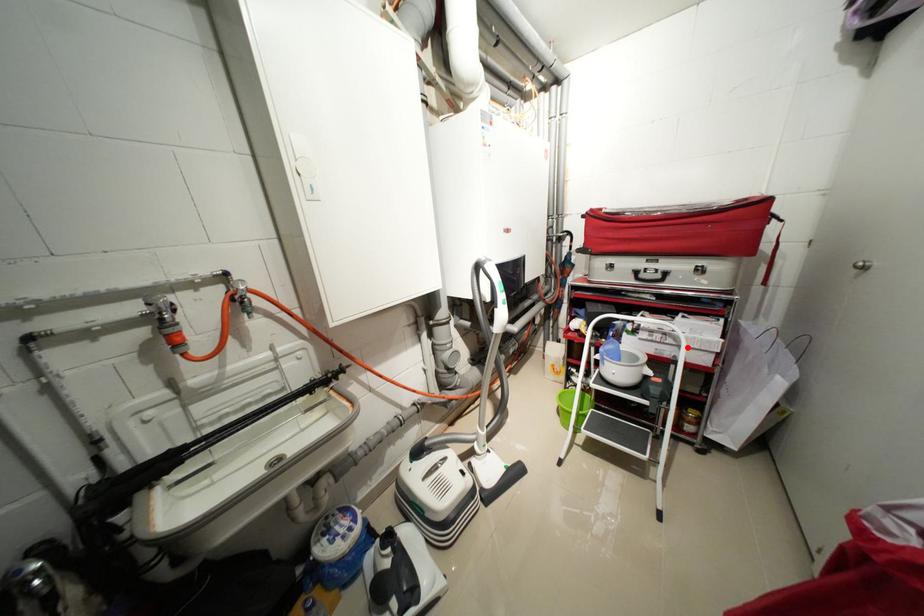
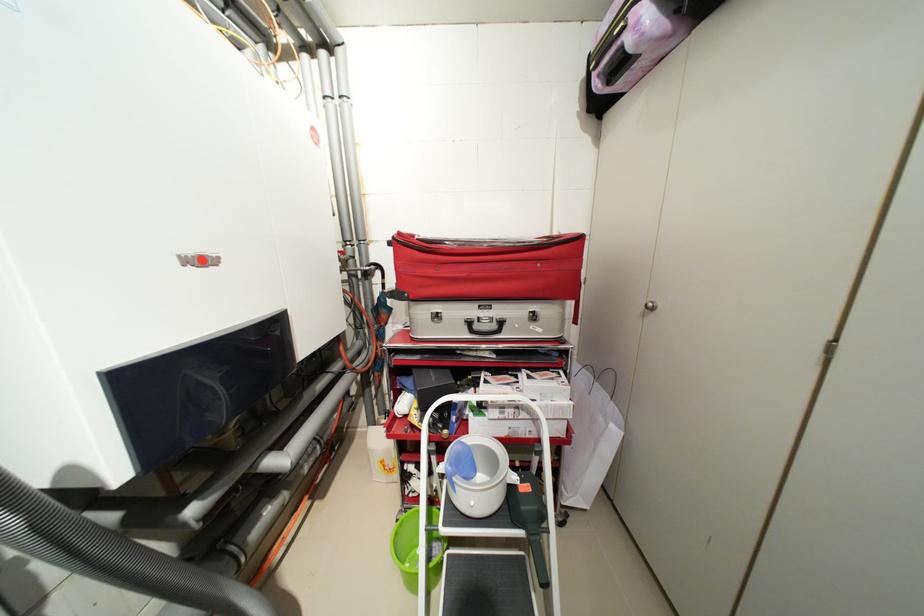
Question: I am providing you with two images of the same scene from different viewpoints. Given a red point in image1, look at the same physical point in image2. Is it:

Choices:
 (A) Closer to the viewpoint
 (B) Farther from the viewpoint

Answer: (B)